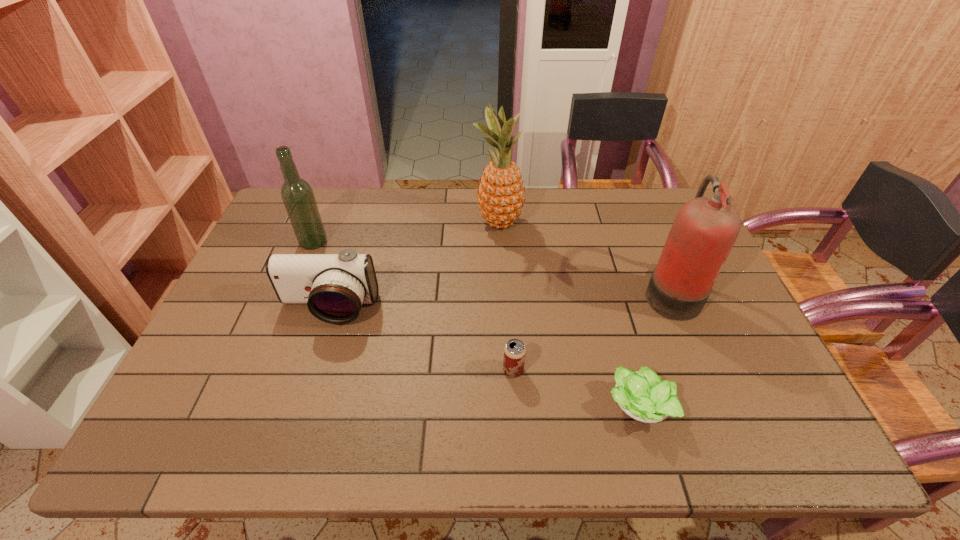
Identify the location of vacant area situated at the nozzle of the fire extinguisher. This screenshot has width=960, height=540. (565, 292).

Where is `vacant space located 0.390m at the nozzle of the fire extinguisher`? vacant space located 0.390m at the nozzle of the fire extinguisher is located at coordinates (505, 292).

The height and width of the screenshot is (540, 960). In order to click on vacant space located on the right of the fourth shortest object in this screenshot , I will do `click(352, 242)`.

In order to click on free location located 0.250m on the surface of the third shortest object in this screenshot , I will do `click(294, 417)`.

Identify the location of vacant area situated on the back of the fifth tallest object. (510, 314).

The height and width of the screenshot is (540, 960). In order to click on free space located 0.380m on the left of the nearest object in this screenshot , I will do `click(436, 407)`.

Where is `object present at the far edge`? The width and height of the screenshot is (960, 540). object present at the far edge is located at coordinates (500, 196).

Where is `object positioned at the near edge`? object positioned at the near edge is located at coordinates (642, 395).

Identify the location of liquor that is at the left edge. pos(297,195).

Identify the location of camcorder present at the left edge. This screenshot has height=540, width=960. (334, 286).